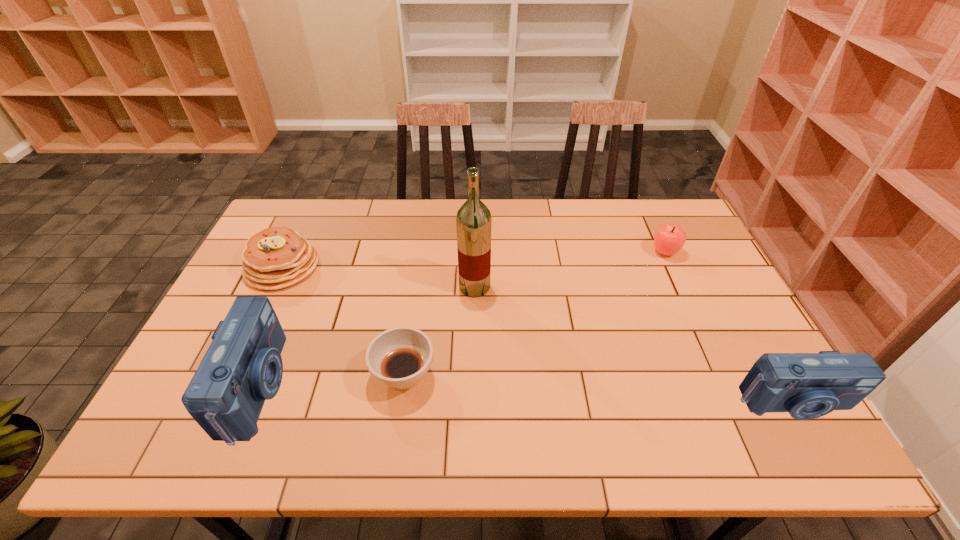
You are a GUI agent. You are given a task and a screenshot of the screen. Output one action in this format:
    pyautogui.click(x=<x>, y=<y>)
    Task: Click on the free spot between the shortest object and the apple
    The width and height of the screenshot is (960, 540).
    Given the screenshot: What is the action you would take?
    (535, 314)

You are a GUI agent. You are given a task and a screenshot of the screen. Output one action in this format:
    pyautogui.click(x=<x>, y=<y>)
    Task: Click on the free space between the right camera and the pancake
    This screenshot has width=960, height=540.
    Given the screenshot: What is the action you would take?
    pyautogui.click(x=538, y=335)

Locate an element on the screen. This screenshot has height=540, width=960. vacant region between the second tallest object and the shortest object is located at coordinates (331, 381).

This screenshot has height=540, width=960. I want to click on vacant area between the second tallest object and the liquor, so click(x=367, y=337).

The width and height of the screenshot is (960, 540). What are the coordinates of `vacant region between the fourth object from left to right and the apple` in the screenshot? It's located at (569, 269).

Where is `free area in between the third object from right to left and the soup bowl`? The height and width of the screenshot is (540, 960). free area in between the third object from right to left and the soup bowl is located at coordinates (440, 331).

Select which object appears as the third closest to the left camera. Please provide its 2D coordinates. Your answer should be formatted as a tuple, i.e. [(x, y)], where the tuple contains the x and y coordinates of a point satisfying the conditions above.

[(473, 221)]

The width and height of the screenshot is (960, 540). I want to click on object that stands as the closest to the liquor, so click(x=399, y=357).